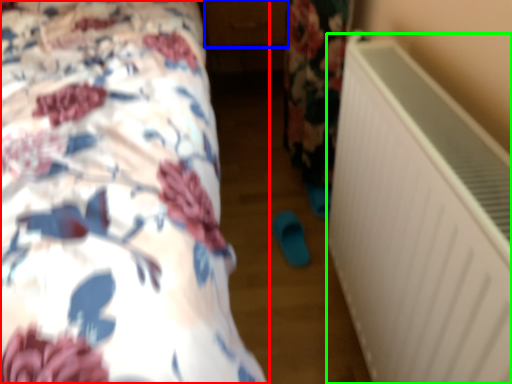
Question: Which object is the farthest from bed (highlighted by a red box)? Choose among these: drawer (highlighted by a blue box) or air conditioning (highlighted by a green box).

Choices:
 (A) drawer
 (B) air conditioning

Answer: (A)